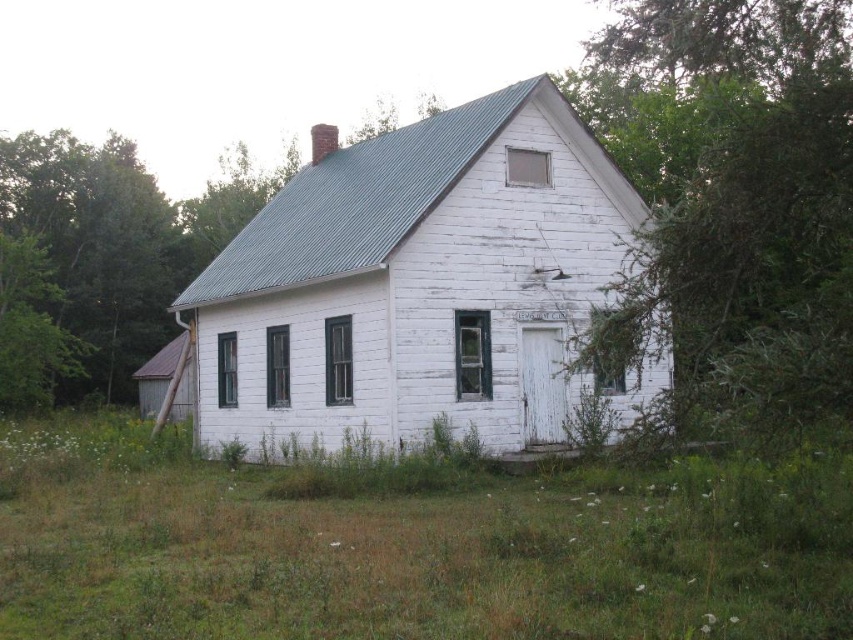
Question: Which point is closer to the camera taking this photo?

Choices:
 (A) (595, 604)
 (B) (846, 340)

Answer: (B)

Question: Which object is positioned closest to the green leafy tree at right?

Choices:
 (A) green leafy tree at left
 (B) green grass at lower center

Answer: (B)

Question: Does green leafy tree at right have a larger size compared to green leafy tree at left?

Choices:
 (A) no
 (B) yes

Answer: (B)

Question: Can you confirm if green grass at lower center is bigger than green leafy tree at left?

Choices:
 (A) yes
 (B) no

Answer: (B)

Question: Considering the real-world distances, which object is farthest from the green grass at lower center?

Choices:
 (A) green leafy tree at right
 (B) green leafy tree at left

Answer: (B)

Question: Does green leafy tree at right have a larger size compared to green leafy tree at left?

Choices:
 (A) no
 (B) yes

Answer: (B)